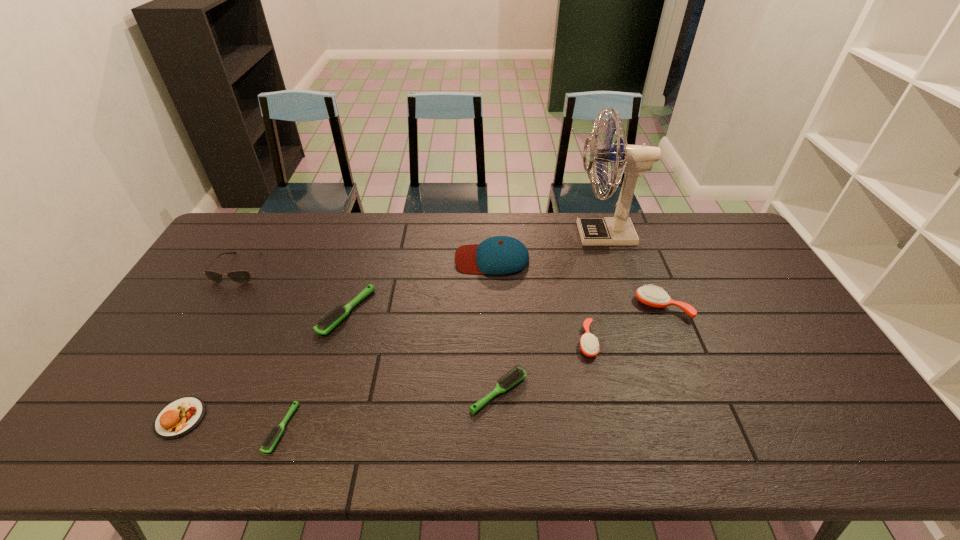
The image size is (960, 540). I want to click on the rightmost light hairbrush, so pos(517,374).

You are a GUI agent. You are given a task and a screenshot of the screen. Output one action in this format:
    pyautogui.click(x=<x>, y=<y>)
    Task: Click on the second smallest light hairbrush
    
    Given the screenshot: What is the action you would take?
    pyautogui.click(x=517, y=374)

What are the coordinates of `the shortest hairbrush` in the screenshot? It's located at (269, 442).

Locate an element on the screen. Image resolution: width=960 pixels, height=540 pixels. the shortest object is located at coordinates (269, 442).

Find the location of a particular element. free region located on the front-facing side of the tallest object is located at coordinates (554, 234).

At what (x,y) coordinates should I click in order to perform the action: click on free location located 0.250m on the front-facing side of the tallest object. Please return your answer as a coordinate pair (x, y). This screenshot has height=540, width=960. Looking at the image, I should click on (505, 234).

Where is `vacant region located on the front-facing side of the tallest object`? The width and height of the screenshot is (960, 540). vacant region located on the front-facing side of the tallest object is located at coordinates (538, 234).

Find the location of a particular element. This screenshot has height=540, width=960. vacant region located 0.260m with the bill of the second tallest object facing forward is located at coordinates (379, 259).

Locate an element on the screen. The image size is (960, 540). free space located 0.220m with the bill of the second tallest object facing forward is located at coordinates (391, 259).

I want to click on vacant space situated with the bill of the second tallest object facing forward, so click(x=373, y=259).